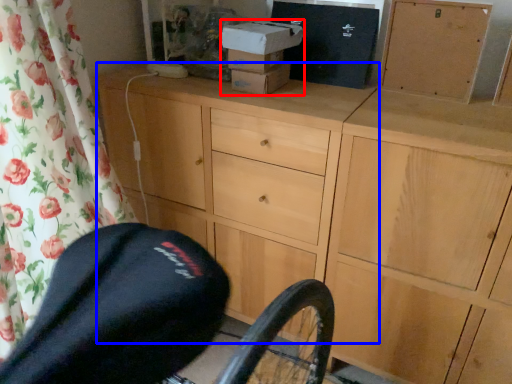
Question: Which object appears farthest to the camera in this image, box (highlighted by a red box) or chest of drawers (highlighted by a blue box)?

Choices:
 (A) box
 (B) chest of drawers

Answer: (A)